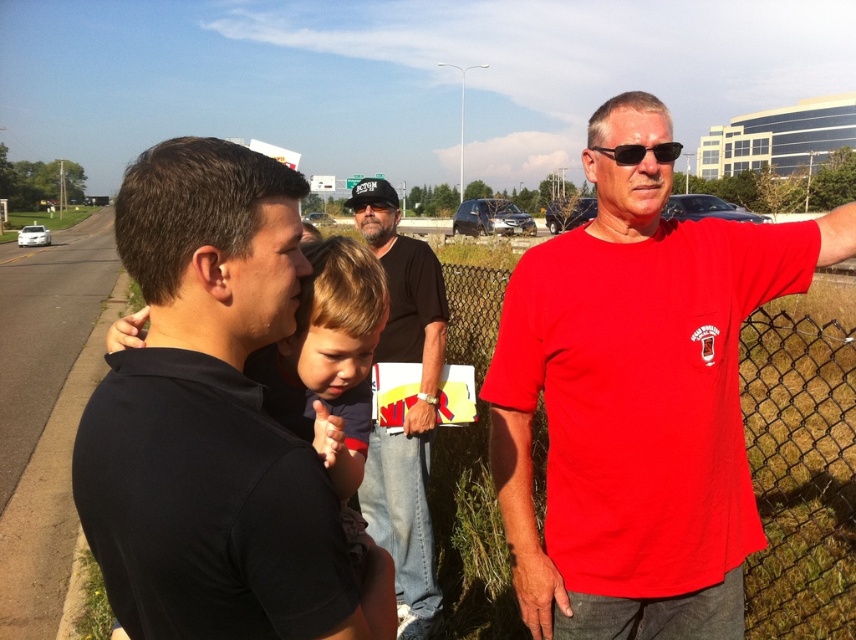
Question: Estimate the real-world distances between objects in this image. Which object is farther from the black cotton t-shirt at center?

Choices:
 (A) black matte shirt at left
 (B) black plastic sunglasses at upper center
 (C) matte red t-shirt at right

Answer: (B)

Question: Is black matte shirt at left behind black cotton t-shirt at center?

Choices:
 (A) yes
 (B) no

Answer: (B)

Question: Which point appears farthest from the camera in this image?

Choices:
 (A) (651, 147)
 (B) (199, 160)
 (C) (405, 636)

Answer: (C)

Question: Which point appears farthest from the camera in this image?

Choices:
 (A) (710, 230)
 (B) (617, 152)

Answer: (A)

Question: In this image, where is matte red t-shirt at right located relative to black cotton t-shirt at center?

Choices:
 (A) left
 (B) right

Answer: (B)

Question: Is matte red t-shirt at right further to camera compared to black cotton t-shirt at center?

Choices:
 (A) no
 (B) yes

Answer: (A)